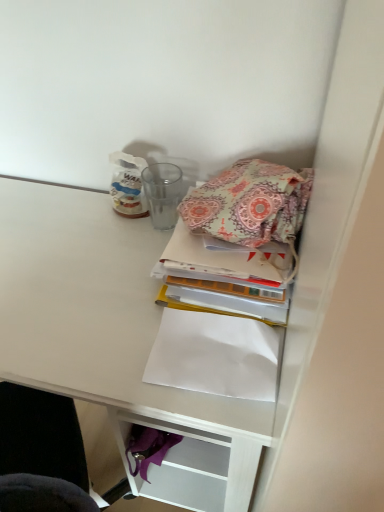
Image resolution: width=384 pixels, height=512 pixels. Find the location of `vacant space situated on the left part of white paper at lower center`. vacant space situated on the left part of white paper at lower center is located at coordinates point(105,346).